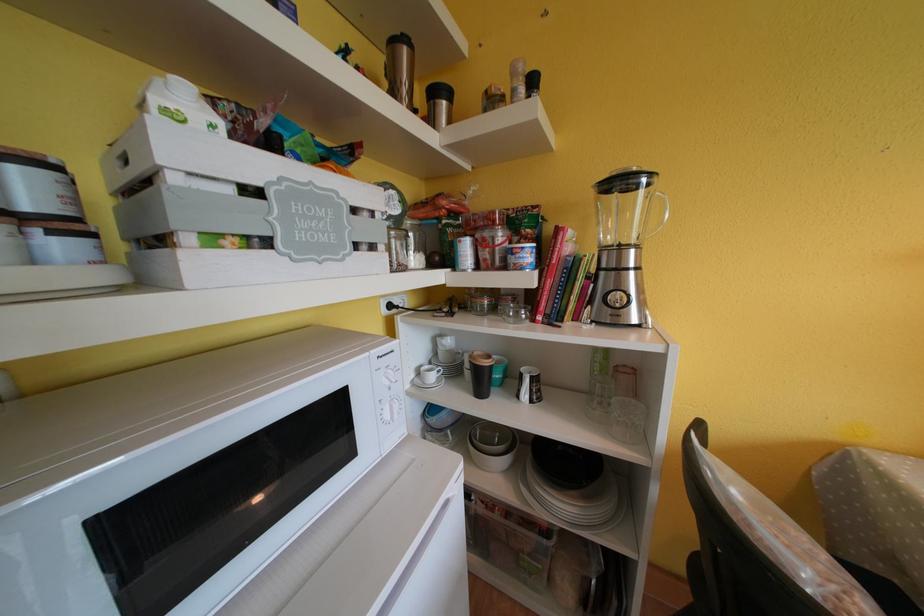
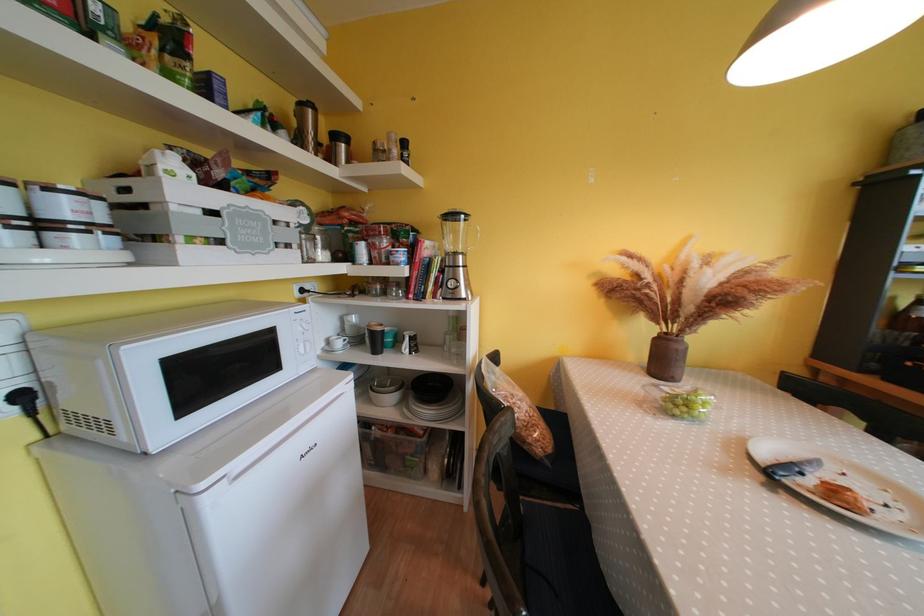
Where in the second image is the point corresponding to point (440, 95) from the first image?

(342, 140)